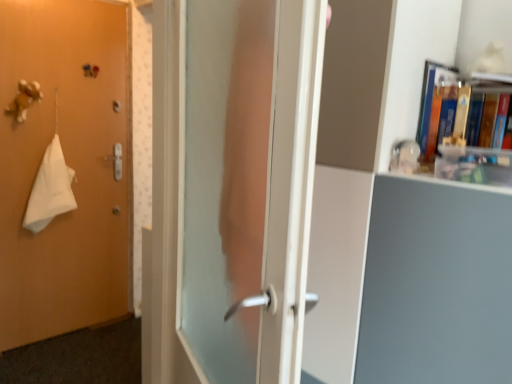
Question: Should I look upward or downward to see transparent glass door at center?

Choices:
 (A) down
 (B) up

Answer: (A)

Question: Is white cloth at left not close to hardcover book at upper right?

Choices:
 (A) yes
 (B) no

Answer: (A)

Question: Does white cloth at left have a smaller size compared to hardcover book at upper right?

Choices:
 (A) no
 (B) yes

Answer: (B)

Question: Is hardcover book at upper right completely or partially inside white cloth at left?

Choices:
 (A) no
 (B) yes

Answer: (A)

Question: Could you tell me if white cloth at left is facing hardcover book at upper right?

Choices:
 (A) no
 (B) yes

Answer: (B)

Question: Considering the relative positions of white cloth at left and hardcover book at upper right in the image provided, is white cloth at left to the left of hardcover book at upper right from the viewer's perspective?

Choices:
 (A) no
 (B) yes

Answer: (B)

Question: Is white cloth at left closer to the viewer compared to hardcover book at upper right?

Choices:
 (A) no
 (B) yes

Answer: (A)

Question: Does white cloth at left have a greater height compared to transparent glass door at center?

Choices:
 (A) yes
 (B) no

Answer: (B)

Question: From a real-world perspective, does white cloth at left stand above transparent glass door at center?

Choices:
 (A) yes
 (B) no

Answer: (B)

Question: Does white cloth at left appear on the left side of transparent glass door at center?

Choices:
 (A) no
 (B) yes

Answer: (B)

Question: Can you confirm if white cloth at left is shorter than transparent glass door at center?

Choices:
 (A) no
 (B) yes

Answer: (B)

Question: Does white cloth at left contain transparent glass door at center?

Choices:
 (A) yes
 (B) no

Answer: (B)

Question: Are white cloth at left and transparent glass door at center located far from each other?

Choices:
 (A) no
 (B) yes

Answer: (B)

Question: Does matte orange door at left have a larger size compared to matte white bookcase at center?

Choices:
 (A) yes
 (B) no

Answer: (B)